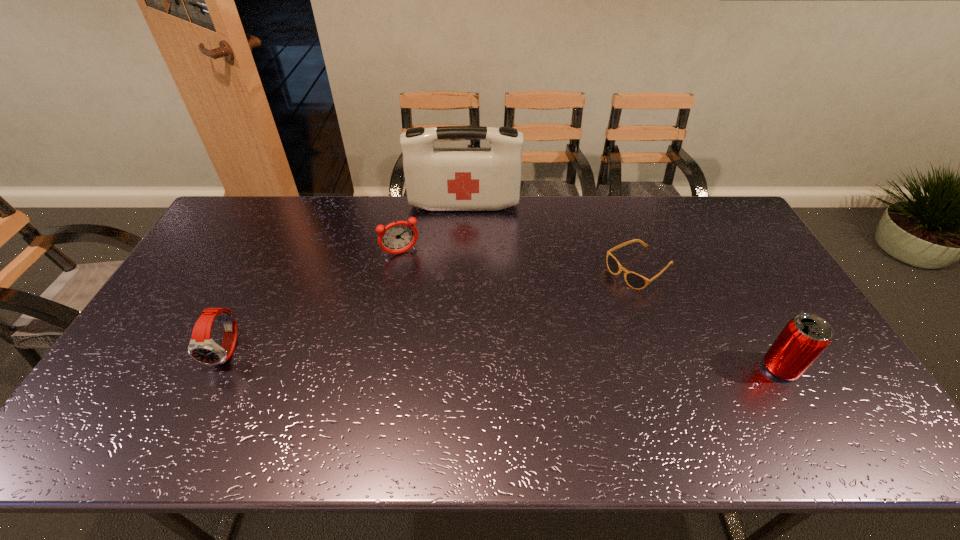
Locate an element on the screen. the leftmost object is located at coordinates (202, 348).

The image size is (960, 540). I want to click on soda can, so click(x=803, y=339).

The height and width of the screenshot is (540, 960). I want to click on the rightmost object, so click(803, 339).

In order to click on the second object from right to left in this screenshot , I will do `click(634, 280)`.

Find the location of a particular element. The width and height of the screenshot is (960, 540). the shortest object is located at coordinates (634, 280).

The height and width of the screenshot is (540, 960). In order to click on alarm clock in this screenshot , I will do `click(397, 237)`.

In order to click on the tallest object in this screenshot , I will do `click(437, 179)`.

The image size is (960, 540). Identify the location of the farthest object. [437, 179].

Where is `free location located on the face of the leftmost object`? This screenshot has width=960, height=540. free location located on the face of the leftmost object is located at coordinates (209, 389).

Locate an element on the screen. free space located 0.320m on the left of the rightmost object is located at coordinates (639, 368).